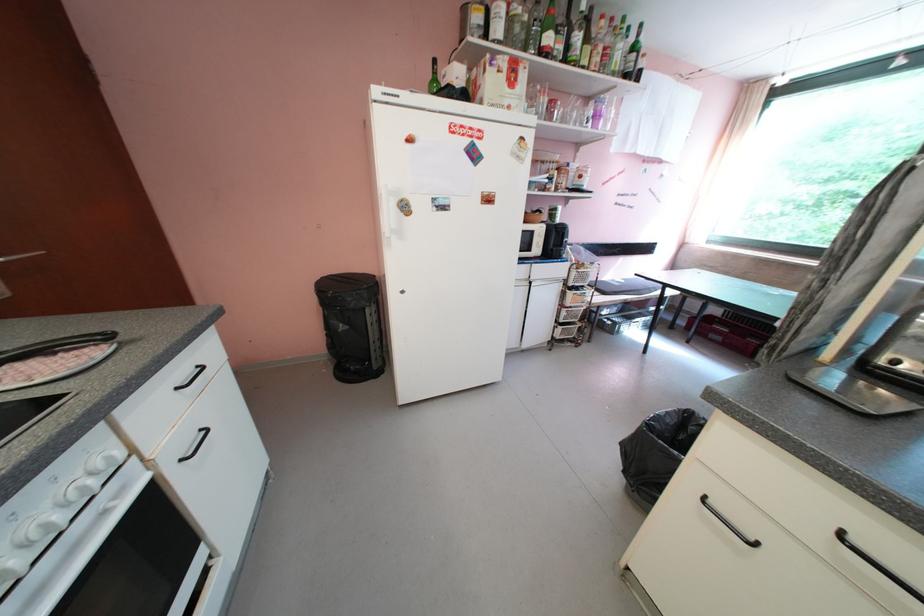
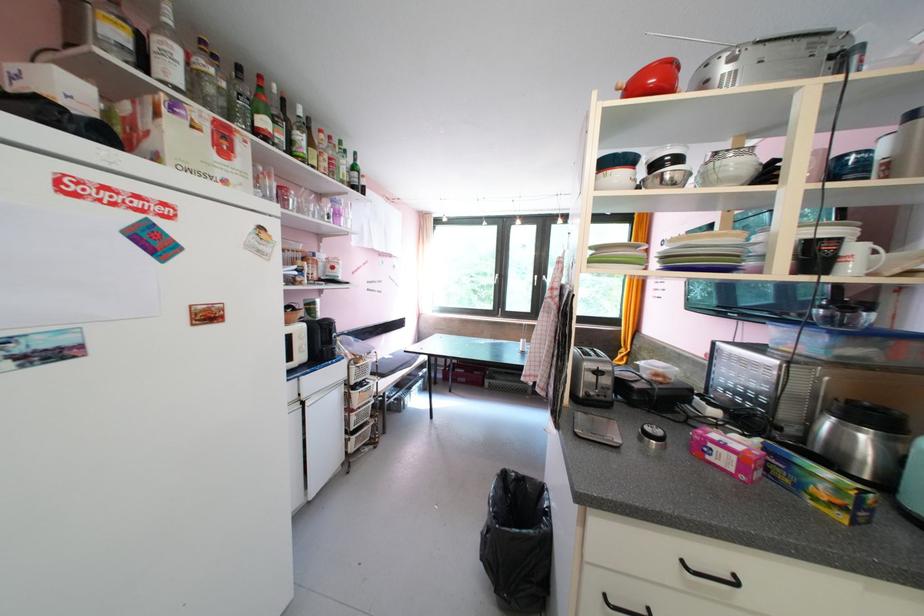
Find the pixel in the second image that matches the point at 568,50 in the first image.

(290, 140)